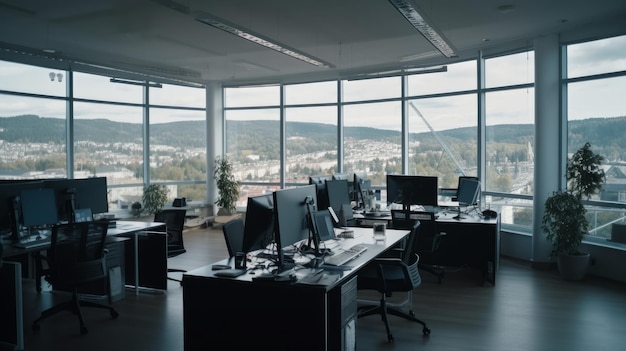
Identify the location of computer screen on desktop. The width and height of the screenshot is (626, 351). (28, 202), (47, 204).